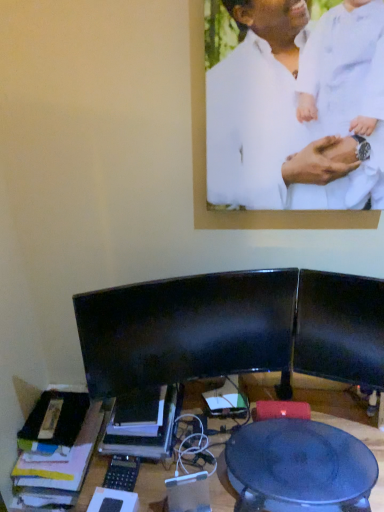
Locate an element on the screen. This screenshot has width=384, height=512. free space above matte black table at center (from a real-world perspective) is located at coordinates (302, 455).